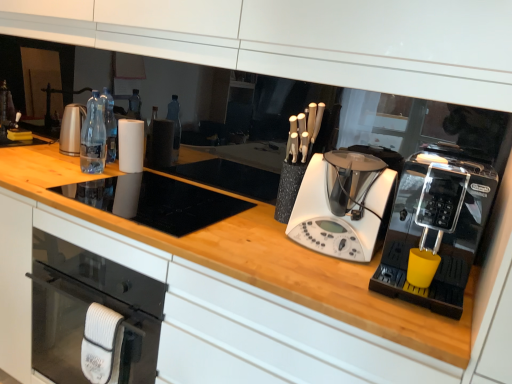
Image resolution: width=512 pixels, height=384 pixels. I want to click on vacant region in front of white plastic blender at center, which ranks as the 1th home appliance in left-to-right order, so click(x=318, y=269).